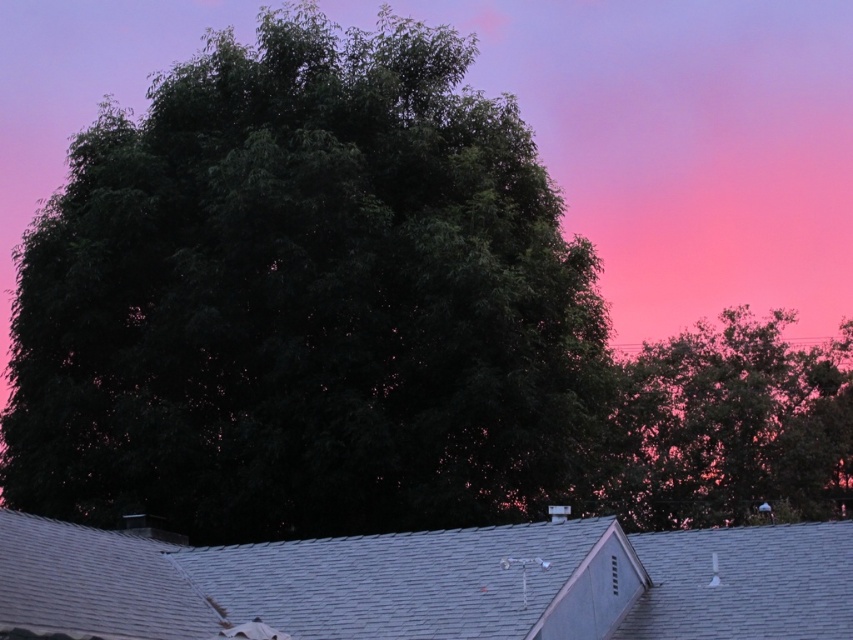
You are standing in the garden and see the dark green leafy tree at center and the green leafy tree at upper right. Which tree is closer to the left side of the garden?

The dark green leafy tree at center is closer to the left side of the garden because it is positioned to the left of the green leafy tree at upper right.

You are a bird flying at an altitude of 10 meters. You want to land on the gray shingles at center from the dark green leafy tree at center. Can you safely descend without hitting any obstacles between them?

The distance between the dark green leafy tree at center and the gray shingles at center is 12.88 meters. Since you are flying at 10 meters altitude, you can safely descend as there are no obstacles mentioned between them.